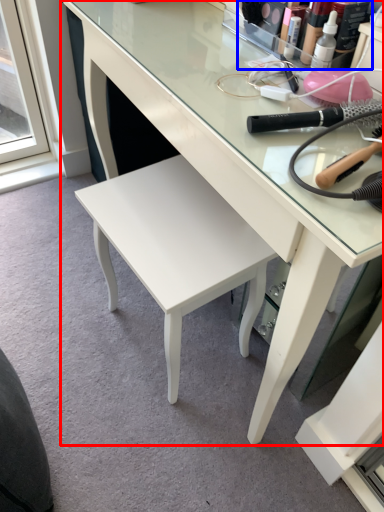
Question: Which object appears farthest to the camera in this image, desk (highlighted by a red box) or toiletry (highlighted by a blue box)?

Choices:
 (A) desk
 (B) toiletry

Answer: (B)